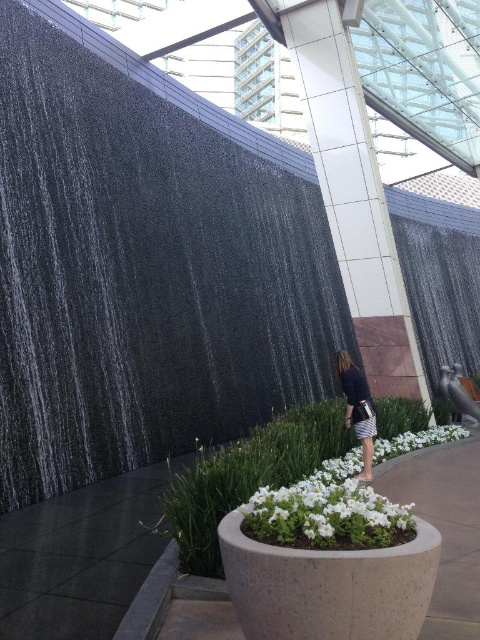
You are designing a layout for a modern event space and need to place a decorative item between the white matte flower pot at center and the dark blue fabric dress at center. Which object should you place closer to the waterfall wall on the left to maintain visual balance?

The white matte flower pot at center is smaller than the dark blue fabric dress at center, so placing the smaller flower pot closer to the waterfall wall on the left would help balance the visual weight, as the larger dress can be positioned further away to counterbalance the waterfall wall.

You are standing in front of the modern architectural setting and want to move from the waterfall wall to the planter. Which point, point (307, 408) or point (396, 436), is closer to you as you walk towards the planter?

Point (307, 408) is closer to you because it is further to the viewer than point (396, 436).